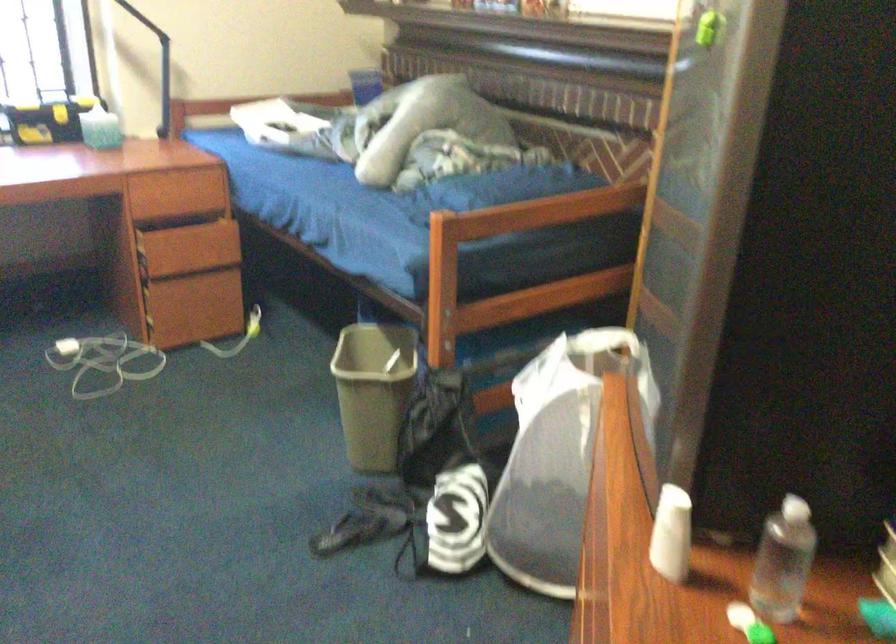
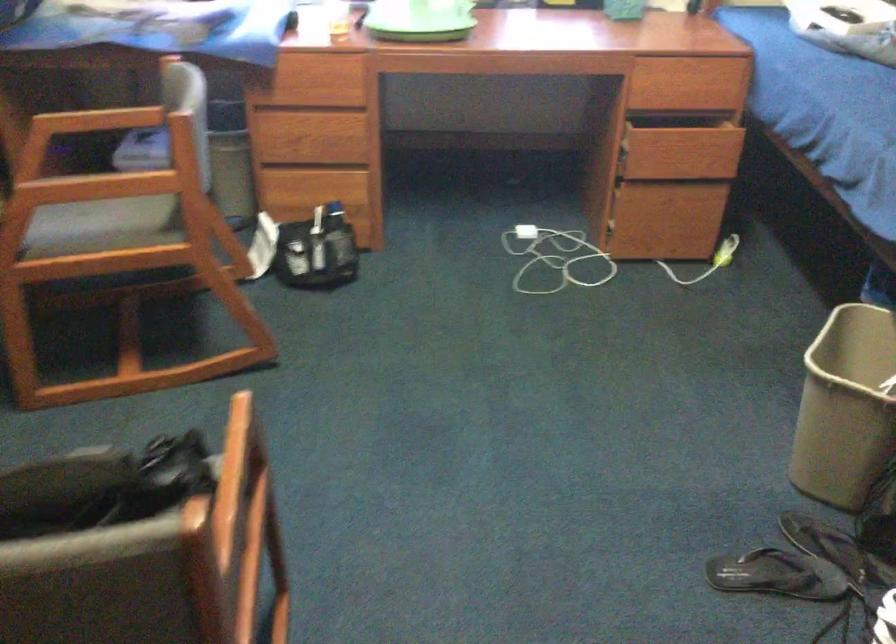
Question: The camera is either moving clockwise (left) or counter-clockwise (right) around the object. The first image is from the beginning of the video and the second image is from the end. Is the camera moving left or right when shooting the video?

Choices:
 (A) Left
 (B) Right

Answer: (B)